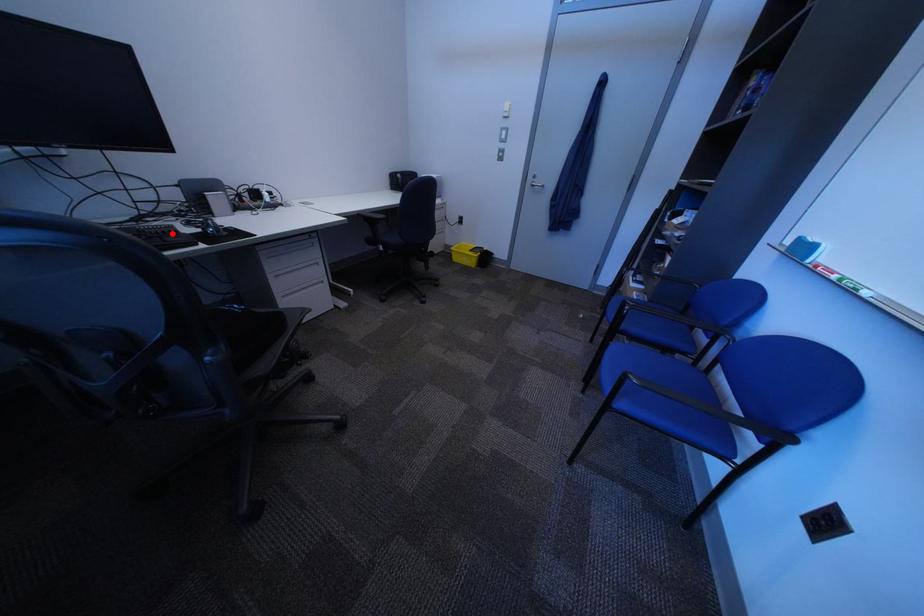
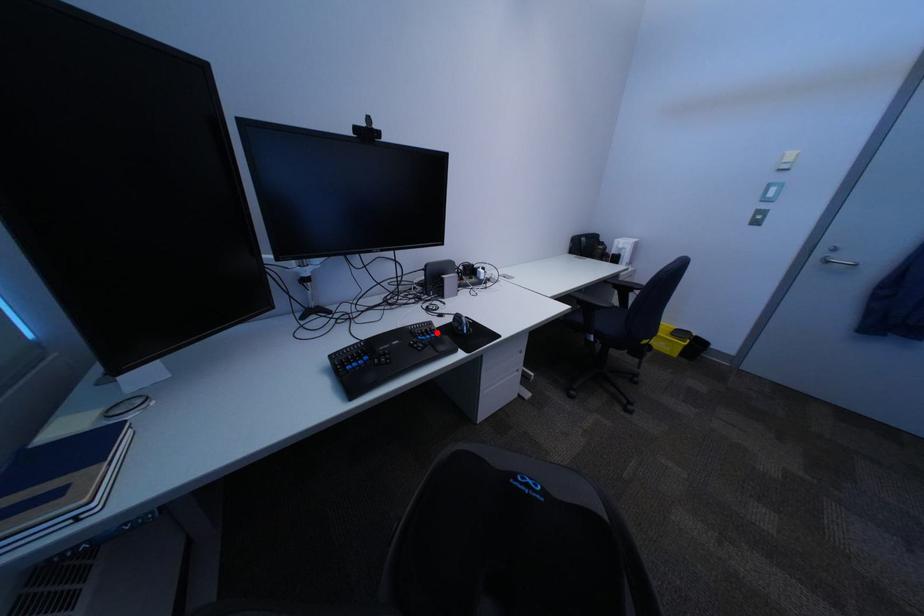
I am providing you with two images of the same scene from different viewpoints. A red point is marked on the first image and another point is marked on the second image. Does the point marked in image1 correspond to the same location as the one in image2?

Yes